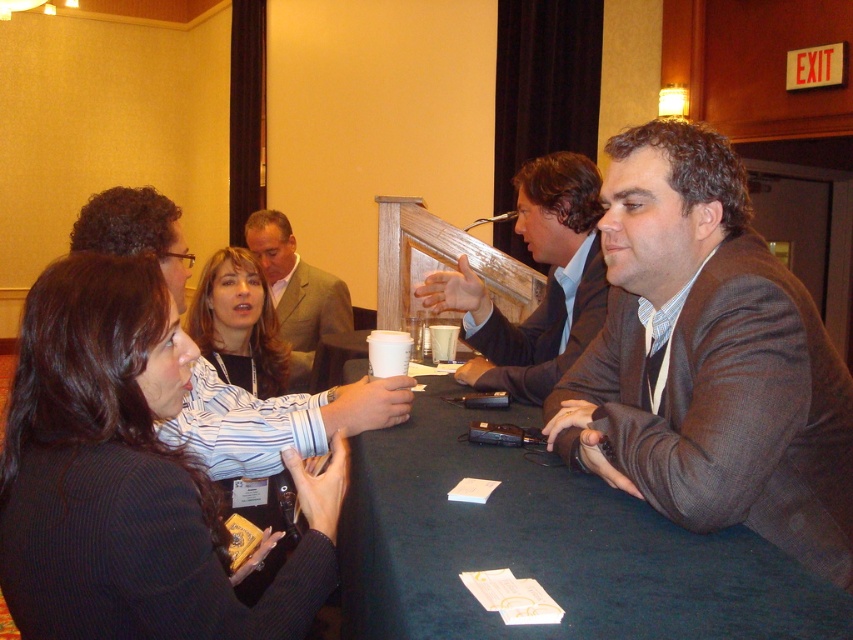
Question: Observing the image, what is the correct spatial positioning of light brown suit at center in reference to light brown textured suit at center?

Choices:
 (A) right
 (B) left

Answer: (B)

Question: Considering the real-world distances, which object is closest to the striped fabric shirt at center?

Choices:
 (A) light brown textured suit at center
 (B) light brown suit at center
 (C) brown woolen suit at center

Answer: (B)

Question: Which point appears closest to the camera in this image?

Choices:
 (A) (781, 595)
 (B) (91, 387)
 (C) (670, 234)

Answer: (A)

Question: Observing the image, what is the correct spatial positioning of dark blue fabric table at center in reference to striped fabric shirt at center?

Choices:
 (A) above
 (B) below

Answer: (B)

Question: Does light brown suit at center appear on the left side of light brown textured suit at center?

Choices:
 (A) no
 (B) yes

Answer: (B)

Question: Which of these objects is positioned farthest from the black pinstripe blazer at center?

Choices:
 (A) striped fabric shirt at center
 (B) light brown suit at center
 (C) light brown textured suit at center
 (D) dark brown suit at center

Answer: (C)